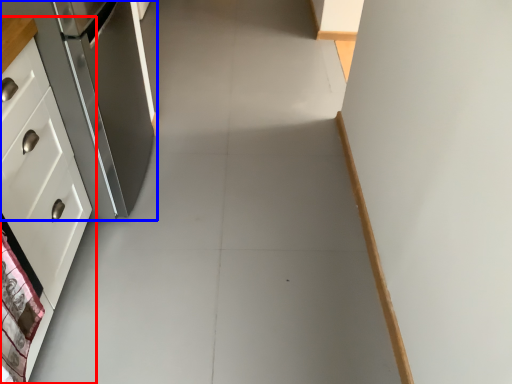
Question: Which object appears farthest to the camera in this image, cabinetry (highlighted by a red box) or refrigerator (highlighted by a blue box)?

Choices:
 (A) cabinetry
 (B) refrigerator

Answer: (B)